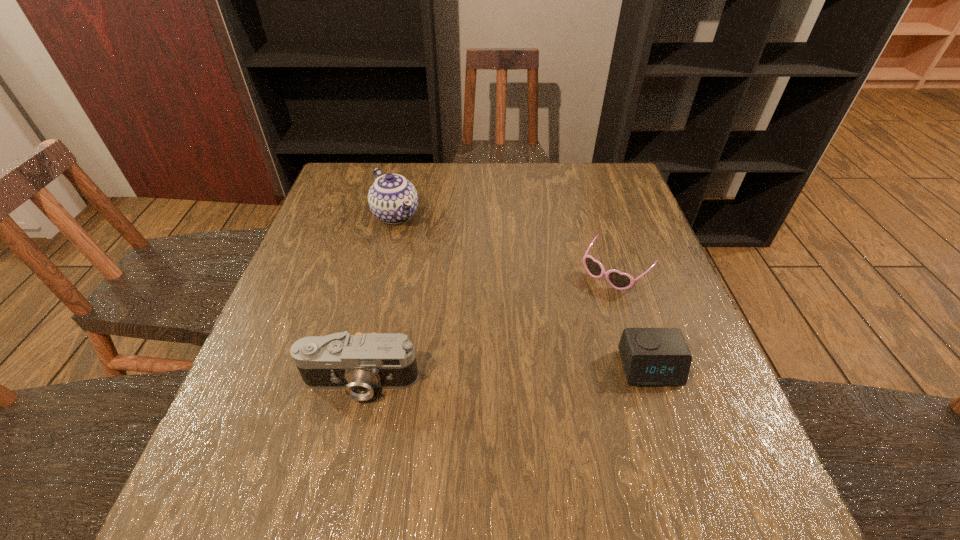
Select which object is the second closest to the second shortest object. Please provide its 2D coordinates. Your answer should be formatted as a tuple, i.e. [(x, y)], where the tuple contains the x and y coordinates of a point satisfying the conditions above.

[(359, 363)]

I want to click on vacant position in the image that satisfies the following two spatial constraints: 1. on the front side of the tallest object; 2. on the left side of the third nearest object, so click(383, 271).

At what (x,y) coordinates should I click in order to perform the action: click on blank area in the image that satisfies the following two spatial constraints: 1. on the front side of the third nearest object; 2. on the right side of the chinaware. Please return your answer as a coordinate pair (x, y). Looking at the image, I should click on (383, 271).